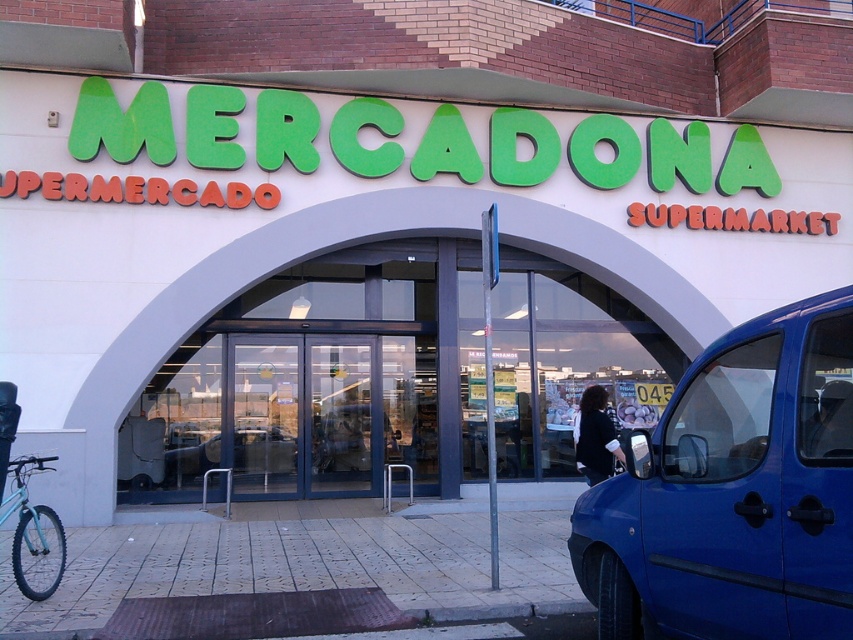
You are standing at the entrance of the Mercadona supermarket. You see two points marked on the floor. The first point is at coordinate point (834, 144) and the second is at point (35, 576). If you are facing the entrance, which point is closer to the exit of the store?

Point (35, 576) is closer to the exit because it is in front of point (834, 144), which is behind it.